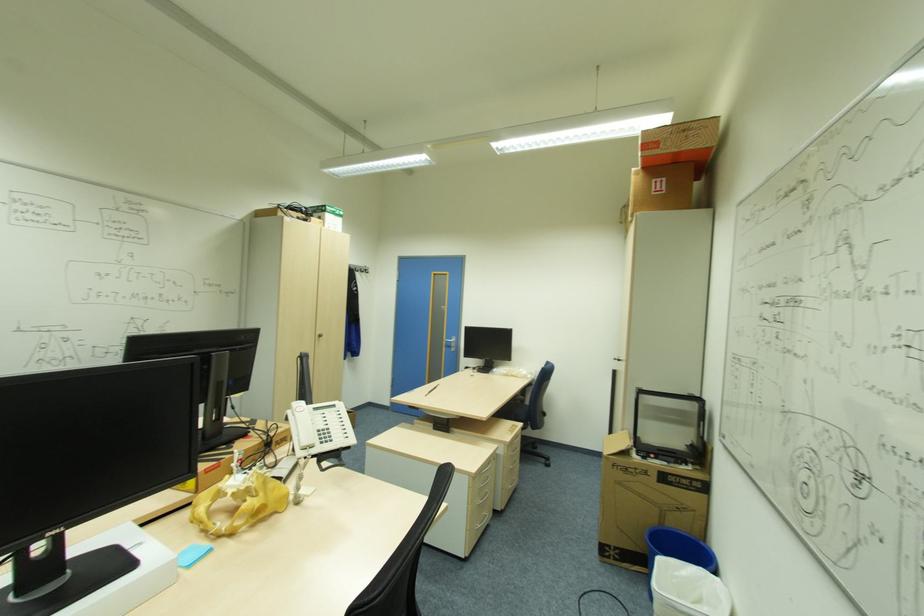
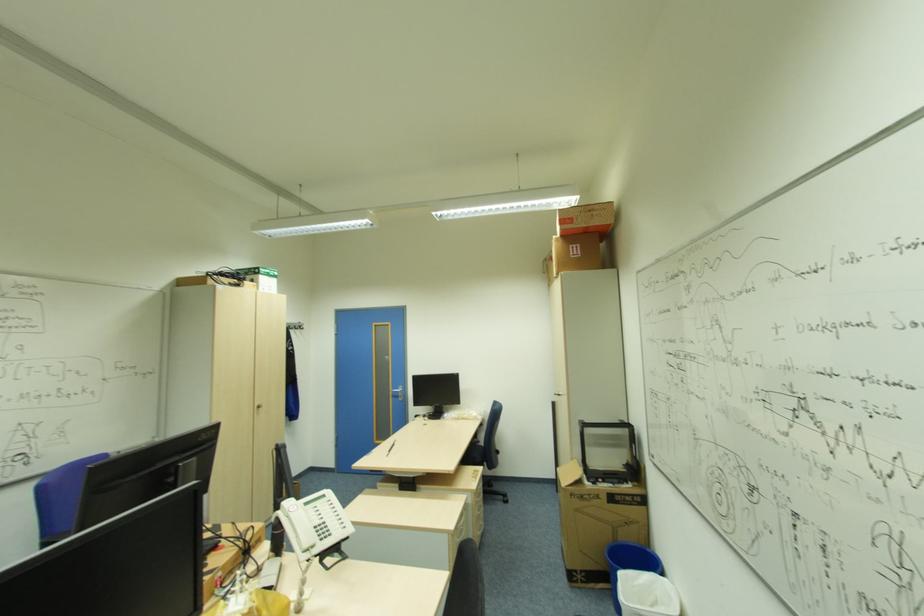
In a continuous first-person perspective shot, in which direction is the camera moving?

The cameraman walked toward left, backward.